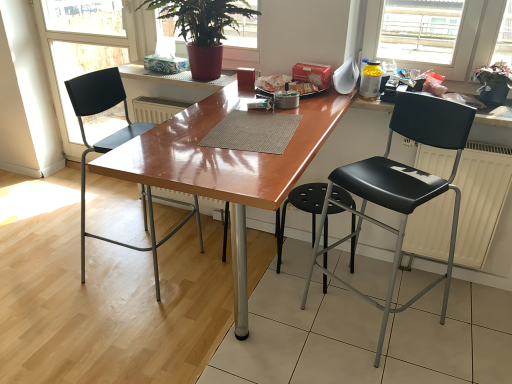
Find the location of a particular element. This screenshot has height=384, width=512. vacant space in front of black plastic chair at left, which is counted as the second chair, starting from the right is located at coordinates (103, 326).